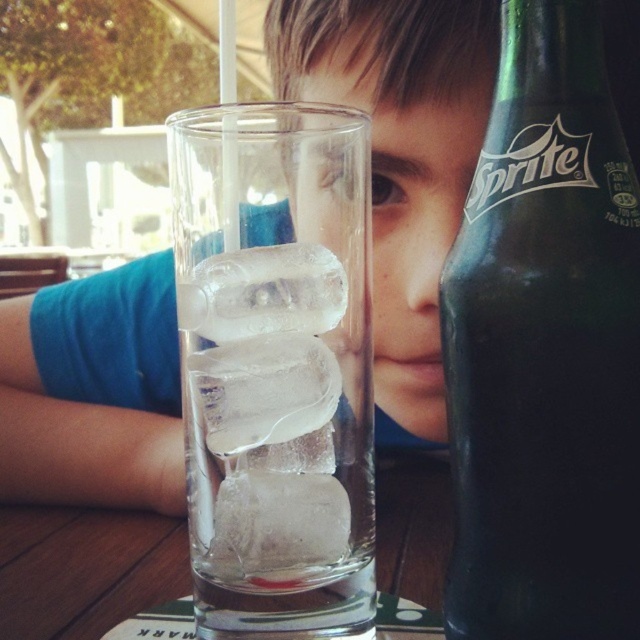
Question: Among these objects, which one is farthest from the camera?

Choices:
 (A) green glass bottle at right
 (B) transparent glass ice at center

Answer: (B)

Question: Can you confirm if green glass bottle at right is positioned to the right of transparent glass ice at center?

Choices:
 (A) no
 (B) yes

Answer: (B)

Question: Is green glass bottle at right above transparent glass ice at center?

Choices:
 (A) no
 (B) yes

Answer: (B)

Question: Which of the following is the closest to the observer?

Choices:
 (A) green glass bottle at right
 (B) transparent glass ice at center

Answer: (A)

Question: Among these points, which one is farthest from the camera?

Choices:
 (A) (506, 296)
 (B) (282, 225)

Answer: (B)

Question: Can you confirm if green glass bottle at right is smaller than transparent glass ice at center?

Choices:
 (A) no
 (B) yes

Answer: (A)